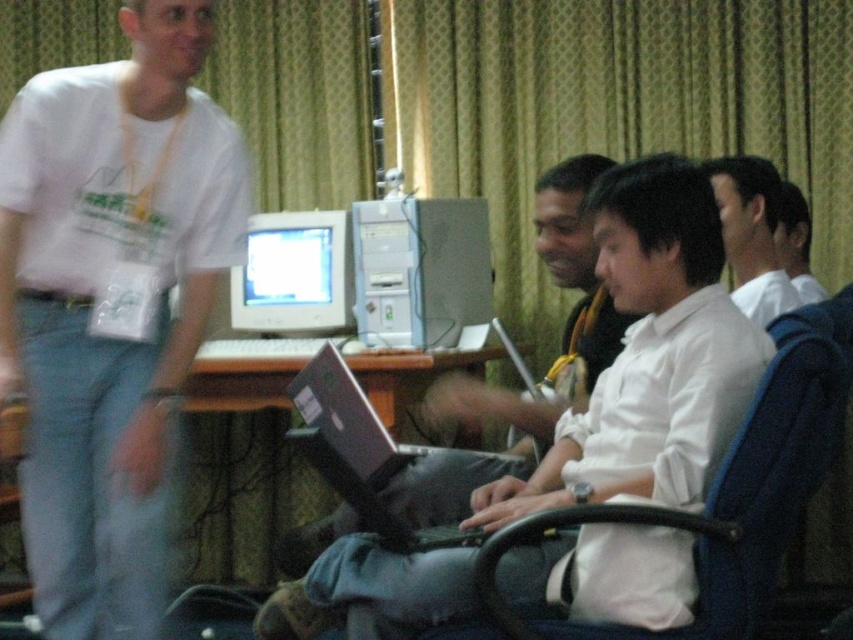
Question: Can you confirm if white matte shirt at upper left is wider than metallic gray laptop at center?

Choices:
 (A) no
 (B) yes

Answer: (A)

Question: Estimate the real-world distances between objects in this image. Which object is farther from the matte gray monitor at center?

Choices:
 (A) silver metallic laptop at center
 (B) white shirt at center

Answer: (B)

Question: Which point appears farthest from the camera in this image?

Choices:
 (A) coord(776,422)
 (B) coord(735,202)

Answer: (B)

Question: Observing the image, what is the correct spatial positioning of blue fabric swivel chair at center right in reference to white shirt at center?

Choices:
 (A) right
 (B) left

Answer: (B)

Question: Does white shirt at center appear over silver metallic laptop at center?

Choices:
 (A) no
 (B) yes

Answer: (B)

Question: Which of the following is the closest to the observer?

Choices:
 (A) (538, 252)
 (B) (439, 333)

Answer: (A)